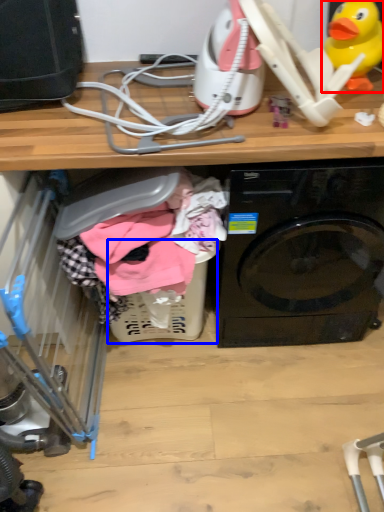
Question: Which object is further to the camera taking this photo, toy (highlighted by a red box) or basket (highlighted by a blue box)?

Choices:
 (A) toy
 (B) basket

Answer: (B)